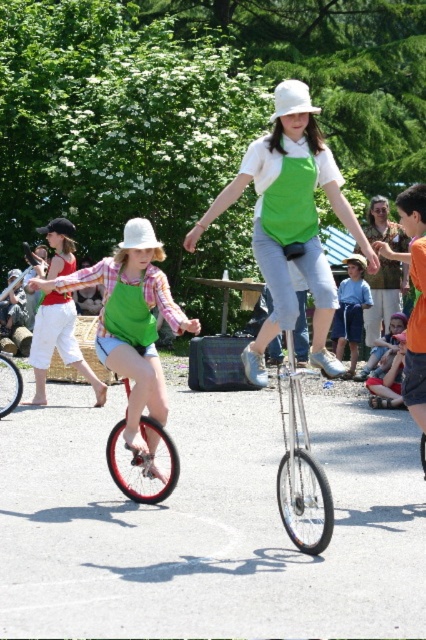
Question: Can you confirm if green fabric dress at center is bigger than silver metallic bicycle at center?

Choices:
 (A) yes
 (B) no

Answer: (A)

Question: Which point appears farthest from the camera in this image?

Choices:
 (A) (367, 376)
 (B) (103, 326)

Answer: (A)

Question: Among these objects, which one is farthest from the camera?

Choices:
 (A) green fabric dress at center
 (B) silver metallic bicycle at center

Answer: (A)

Question: Can you confirm if green matte apron at center is positioned below green fabric dress at center?

Choices:
 (A) no
 (B) yes

Answer: (A)

Question: Can you confirm if blue denim shorts at center is positioned below silver metallic bicycle at center?

Choices:
 (A) no
 (B) yes

Answer: (A)

Question: Which is farther from the blue denim shorts at center?

Choices:
 (A) green fabric dress at center
 (B) silver metallic bicycle at center

Answer: (B)